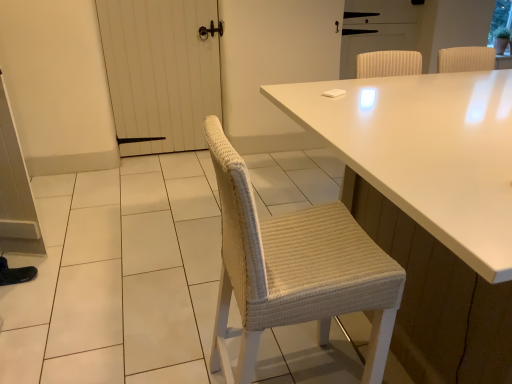
What do you see at coordinates (425, 151) in the screenshot? I see `white glossy table at center` at bounding box center [425, 151].

Describe the element at coordinates (373, 42) in the screenshot. The width and height of the screenshot is (512, 384). I see `white ribbed screen door at upper center, the 2th screen door positioned from the left` at that location.

Locate an element on the screen. The image size is (512, 384). white wooden door at left, arranged as the 2th screen door when viewed from the right is located at coordinates (161, 70).

The height and width of the screenshot is (384, 512). I want to click on white glossy table at center, so click(x=425, y=151).

What's the angular difference between white glossy table at center and white wooden door at left, the first screen door in the left-to-right sequence,'s facing directions?

There is a 180-degree angle between the facing directions of white glossy table at center and white wooden door at left, the first screen door in the left-to-right sequence.

Which is in front, point (490, 175) or point (114, 70)?

Point (490, 175)

In the scene shown: Are white glossy table at center and white wooden door at left, the first screen door in the left-to-right sequence, located far from each other?

white glossy table at center is positioned a significant distance from white wooden door at left, the first screen door in the left-to-right sequence.

Is white ribbed screen door at upper center, acting as the 1th screen door starting from the right, positioned behind white wooden door at left, the first screen door in the left-to-right sequence?

Yes, white ribbed screen door at upper center, acting as the 1th screen door starting from the right, is behind white wooden door at left, the first screen door in the left-to-right sequence.

At what (x,y) coordinates should I click in order to perform the action: click on screen door behind the white wooden door at left, arranged as the 2th screen door when viewed from the right. Please return your answer as a coordinate pair (x, y). The width and height of the screenshot is (512, 384). Looking at the image, I should click on (373, 42).

Is point (376, 50) more distant than point (167, 126)?

That is True.

Which is more to the right, white ribbed screen door at upper center, the 2th screen door positioned from the left, or white wooden door at left, the first screen door in the left-to-right sequence?

Positioned to the right is white ribbed screen door at upper center, the 2th screen door positioned from the left.

Considering the sizes of objects white ribbed screen door at upper center, acting as the 1th screen door starting from the right, and white glossy table at center in the image provided, who is smaller, white ribbed screen door at upper center, acting as the 1th screen door starting from the right, or white glossy table at center?

white ribbed screen door at upper center, acting as the 1th screen door starting from the right.

Would you consider white ribbed screen door at upper center, acting as the 1th screen door starting from the right, to be distant from white glossy table at center?

Indeed, white ribbed screen door at upper center, acting as the 1th screen door starting from the right, is not near white glossy table at center.

What's the angular difference between white ribbed screen door at upper center, acting as the 1th screen door starting from the right, and white glossy table at center's facing directions?

They differ by 180 degrees in their facing directions.

Is white wooden door at left, arranged as the 2th screen door when viewed from the right, surrounding white ribbed screen door at upper center, acting as the 1th screen door starting from the right?

No, white ribbed screen door at upper center, acting as the 1th screen door starting from the right, is not inside white wooden door at left, arranged as the 2th screen door when viewed from the right.

Find the location of a particular element. The width and height of the screenshot is (512, 384). screen door that appears below the white ribbed screen door at upper center, the 2th screen door positioned from the left (from a real-world perspective) is located at coordinates (161, 70).

Between white wooden door at left, arranged as the 2th screen door when viewed from the right, and white ribbed screen door at upper center, acting as the 1th screen door starting from the right, which one has smaller width?

With smaller width is white ribbed screen door at upper center, acting as the 1th screen door starting from the right.

From the image's perspective, relative to white ribbed screen door at upper center, the 2th screen door positioned from the left, is white wooden door at left, arranged as the 2th screen door when viewed from the right, above or below?

From the image's perspective, white wooden door at left, arranged as the 2th screen door when viewed from the right, appears below white ribbed screen door at upper center, the 2th screen door positioned from the left.

Considering the sizes of white glossy table at center and white ribbed screen door at upper center, acting as the 1th screen door starting from the right, in the image, is white glossy table at center bigger or smaller than white ribbed screen door at upper center, acting as the 1th screen door starting from the right,?

In the image, white glossy table at center appears to be larger than white ribbed screen door at upper center, acting as the 1th screen door starting from the right.

Is white glossy table at center inside or outside of white ribbed screen door at upper center, acting as the 1th screen door starting from the right?

white glossy table at center cannot be found inside white ribbed screen door at upper center, acting as the 1th screen door starting from the right.

Is white glossy table at center turned away from white ribbed screen door at upper center, acting as the 1th screen door starting from the right?

That's not correct — white glossy table at center is not looking away from white ribbed screen door at upper center, acting as the 1th screen door starting from the right.

From the image's perspective, does white glossy table at center appear lower than white ribbed screen door at upper center, acting as the 1th screen door starting from the right?

Yes.

From the image's perspective, which one is positioned higher, white wooden door at left, the first screen door in the left-to-right sequence, or white glossy table at center?

From the image's view, white wooden door at left, the first screen door in the left-to-right sequence, is above.

Can you see white wooden door at left, arranged as the 2th screen door when viewed from the right, touching white glossy table at center?

There is a gap between white wooden door at left, arranged as the 2th screen door when viewed from the right, and white glossy table at center.

Can you confirm if white wooden door at left, the first screen door in the left-to-right sequence, is bigger than white glossy table at center?

No.

You are a GUI agent. You are given a task and a screenshot of the screen. Output one action in this format:
    pyautogui.click(x=<x>, y=<y>)
    Task: Click on the table that appears on the right of white wooden door at left, the first screen door in the left-to-right sequence
    
    Given the screenshot: What is the action you would take?
    pyautogui.click(x=425, y=151)

This screenshot has height=384, width=512. I want to click on screen door above the white wooden door at left, arranged as the 2th screen door when viewed from the right (from the image's perspective), so [373, 42].

Estimate the real-world distances between objects in this image. Which object is further from white glossy table at center, white wooden door at left, arranged as the 2th screen door when viewed from the right, or white ribbed screen door at upper center, acting as the 1th screen door starting from the right?

white ribbed screen door at upper center, acting as the 1th screen door starting from the right, is further to white glossy table at center.

When comparing their distances from white wooden door at left, arranged as the 2th screen door when viewed from the right, does white glossy table at center or white ribbed screen door at upper center, acting as the 1th screen door starting from the right, seem closer?

white ribbed screen door at upper center, acting as the 1th screen door starting from the right, lies closer to white wooden door at left, arranged as the 2th screen door when viewed from the right, than the other object.

Estimate the real-world distances between objects in this image. Which object is further from white ribbed screen door at upper center, acting as the 1th screen door starting from the right, white glossy table at center or white wooden door at left, the first screen door in the left-to-right sequence?

white glossy table at center is positioned further to the anchor white ribbed screen door at upper center, acting as the 1th screen door starting from the right.

Based on their spatial positions, is white ribbed screen door at upper center, acting as the 1th screen door starting from the right, or white wooden door at left, the first screen door in the left-to-right sequence, further from white glossy table at center?

Based on the image, white ribbed screen door at upper center, acting as the 1th screen door starting from the right, appears to be further to white glossy table at center.

When comparing their distances from white wooden door at left, the first screen door in the left-to-right sequence, does white ribbed screen door at upper center, the 2th screen door positioned from the left, or white glossy table at center seem closer?

white ribbed screen door at upper center, the 2th screen door positioned from the left, is closer to white wooden door at left, the first screen door in the left-to-right sequence.

Considering their positions, is white wooden door at left, the first screen door in the left-to-right sequence, positioned further to white ribbed screen door at upper center, the 2th screen door positioned from the left, than white glossy table at center?

white glossy table at center is positioned further to the anchor white ribbed screen door at upper center, the 2th screen door positioned from the left.

Find the location of a particular element. This screenshot has height=384, width=512. screen door located between white glossy table at center and white ribbed screen door at upper center, the 2th screen door positioned from the left, in the depth direction is located at coordinates (161, 70).